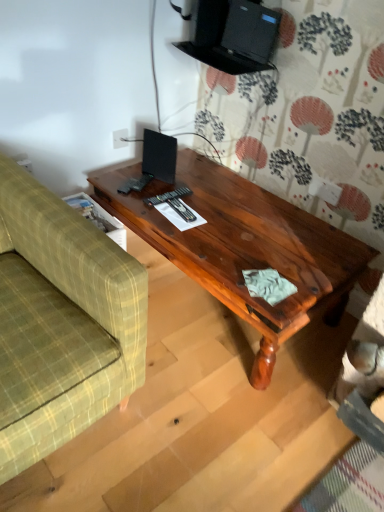
Question: Is green plaid fabric couch at left positioned far away from shiny brown wood coffee table at center?

Choices:
 (A) yes
 (B) no

Answer: (B)

Question: From the image's perspective, would you say green plaid fabric couch at left is positioned over shiny brown wood coffee table at center?

Choices:
 (A) yes
 (B) no

Answer: (B)

Question: Is green plaid fabric couch at left touching shiny brown wood coffee table at center?

Choices:
 (A) yes
 (B) no

Answer: (B)

Question: Is shiny brown wood coffee table at center completely or partially inside green plaid fabric couch at left?

Choices:
 (A) no
 (B) yes

Answer: (A)

Question: Does green plaid fabric couch at left appear on the left side of shiny brown wood coffee table at center?

Choices:
 (A) no
 (B) yes

Answer: (B)

Question: Can you confirm if green plaid fabric couch at left is positioned to the right of shiny brown wood coffee table at center?

Choices:
 (A) yes
 (B) no

Answer: (B)

Question: Can you confirm if shiny brown wood coffee table at center is positioned to the right of green plaid fabric couch at left?

Choices:
 (A) no
 (B) yes

Answer: (B)

Question: Is shiny brown wood coffee table at center next to green plaid fabric couch at left and touching it?

Choices:
 (A) yes
 (B) no

Answer: (B)

Question: Can green plaid fabric couch at left be found inside shiny brown wood coffee table at center?

Choices:
 (A) yes
 (B) no

Answer: (B)

Question: Is shiny brown wood coffee table at center oriented away from green plaid fabric couch at left?

Choices:
 (A) no
 (B) yes

Answer: (A)

Question: Is shiny brown wood coffee table at center positioned far away from green plaid fabric couch at left?

Choices:
 (A) no
 (B) yes

Answer: (A)

Question: Is shiny brown wood coffee table at center closer to camera compared to green plaid fabric couch at left?

Choices:
 (A) no
 (B) yes

Answer: (A)

Question: Considering the positions of shiny brown wood coffee table at center and green plaid fabric couch at left in the image, is shiny brown wood coffee table at center taller or shorter than green plaid fabric couch at left?

Choices:
 (A) short
 (B) tall

Answer: (A)